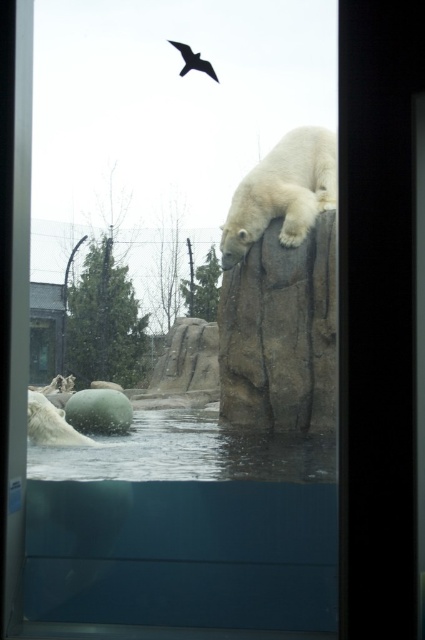
Can you confirm if transparent glass pool at lower center is wider than black feathered bird at upper center?

Indeed, transparent glass pool at lower center has a greater width compared to black feathered bird at upper center.

Does transparent glass pool at lower center lie in front of black feathered bird at upper center?

No, it is behind black feathered bird at upper center.

Where is `transparent glass pool at lower center`? This screenshot has height=640, width=425. transparent glass pool at lower center is located at coordinates click(184, 529).

Locate an element on the screen. The height and width of the screenshot is (640, 425). transparent glass pool at lower center is located at coordinates (184, 529).

Which is above, white fur bear at upper center or black feathered bird at upper center?

white fur bear at upper center is higher up.

Is point (257, 221) farther from camera compared to point (175, 40)?

Yes.

Image resolution: width=425 pixels, height=640 pixels. What are the coordinates of `white fur bear at upper center` in the screenshot? It's located at (283, 193).

The image size is (425, 640). Describe the element at coordinates (280, 333) in the screenshot. I see `smooth gray rock at center` at that location.

Is smooth gray rock at center below white fur bear at upper center?

Yes.

Which is in front, point (278, 339) or point (283, 244)?

Positioned in front is point (278, 339).

At what (x,y) coordinates should I click in order to perform the action: click on smooth gray rock at center. Please return your answer as a coordinate pair (x, y). This screenshot has width=425, height=640. Looking at the image, I should click on (280, 333).